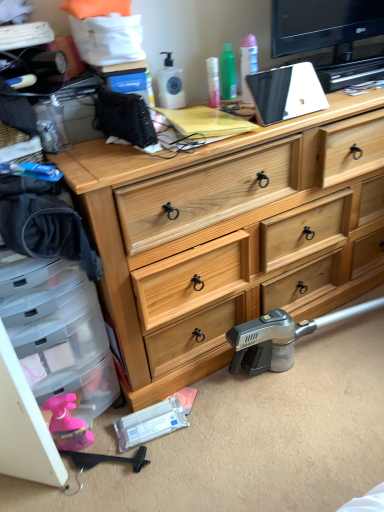
Identify the location of unoccupied area behind black plastic hammer at lower left. This screenshot has height=512, width=384. (108, 428).